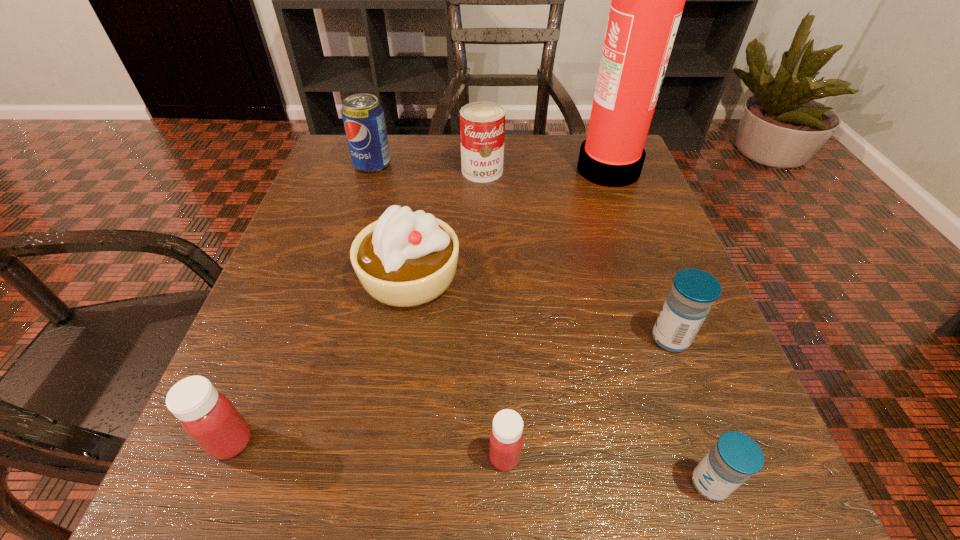
Identify the location of object identified as the seventh closest to the can. This screenshot has width=960, height=540. (735, 457).

At what (x,y) coordinates should I click in order to perform the action: click on medicine that can be found as the second closest to the fourth farthest object. Please return your answer as a coordinate pair (x, y). The height and width of the screenshot is (540, 960). Looking at the image, I should click on (506, 437).

Identify which medicine is located as the third nearest to the right red medicine. Please provide its 2D coordinates. Your answer should be formatted as a tuple, i.e. [(x, y)], where the tuple contains the x and y coordinates of a point satisfying the conditions above.

[(208, 417)]

The image size is (960, 540). In order to click on vacant space that satisfies the following two spatial constraints: 1. with the nozzle aimed from the tallest object; 2. on the front side of the leftmost object in this screenshot , I will do `click(708, 442)`.

Locate an element on the screen. vacant point that satisfies the following two spatial constraints: 1. on the front side of the beige whipped cream; 2. on the left side of the second medicine from left to right is located at coordinates (382, 457).

At what (x,y) coordinates should I click in order to perform the action: click on free location that satisfies the following two spatial constraints: 1. on the front label of the smaller blue medicine; 2. on the left side of the can. Please return your answer as a coordinate pair (x, y). This screenshot has height=540, width=960. Looking at the image, I should click on (485, 484).

Locate an element on the screen. The height and width of the screenshot is (540, 960). free location that satisfies the following two spatial constraints: 1. with the nozzle aimed from the fire extinguisher; 2. on the back side of the fourth nearest object is located at coordinates (670, 339).

The height and width of the screenshot is (540, 960). Find the location of `vacant space that satisfies the following two spatial constraints: 1. on the front side of the nearer blue medicine; 2. on the left side of the smaller red medicine`. vacant space that satisfies the following two spatial constraints: 1. on the front side of the nearer blue medicine; 2. on the left side of the smaller red medicine is located at coordinates (506, 484).